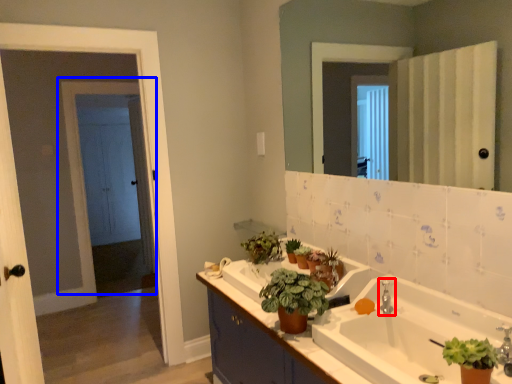
Question: Which point is closer to the camera, tap (highlighted by a red box) or door (highlighted by a blue box)?

Choices:
 (A) tap
 (B) door

Answer: (A)